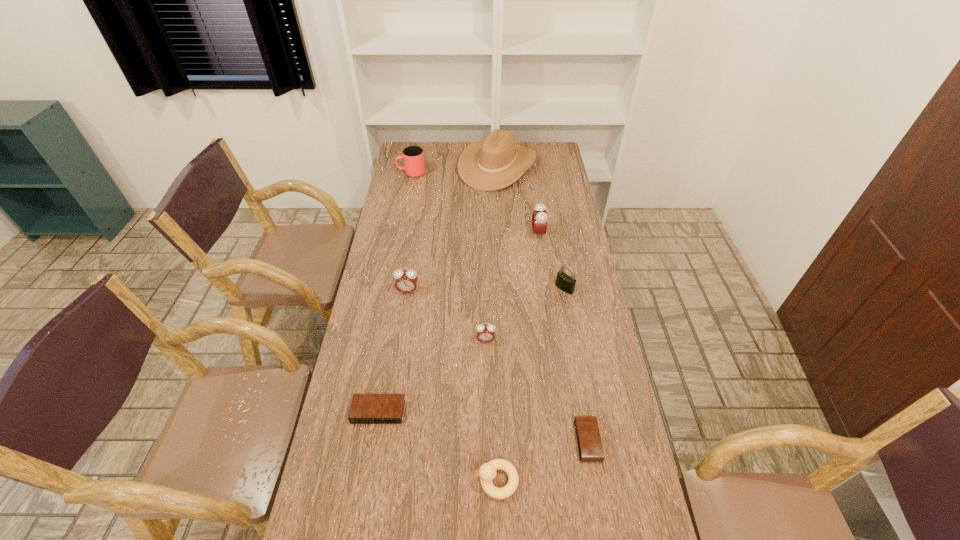
Where is `the left black alarm clock`? The height and width of the screenshot is (540, 960). the left black alarm clock is located at coordinates (365, 408).

The width and height of the screenshot is (960, 540). What are the coordinates of `the bigger black alarm clock` in the screenshot? It's located at (365, 408).

This screenshot has height=540, width=960. Identify the location of the shortest alarm clock. (590, 448).

Identify the location of the smaller black alarm clock. (590, 448).

Locate an element on the screen. The width and height of the screenshot is (960, 540). vacant space located on the right of the brown cowboy hat is located at coordinates (558, 166).

I want to click on free region located on the clock face of the rightmost pink alarm clock, so click(437, 234).

Locate an element on the screen. free region located 0.090m on the clock face of the rightmost pink alarm clock is located at coordinates (511, 234).

Locate an element on the screen. The image size is (960, 540). vacant space situated 0.300m on the clock face of the rightmost pink alarm clock is located at coordinates (461, 234).

I want to click on free point located 0.260m on the clock face of the second farthest pink alarm clock, so click(397, 355).

Find the location of `blank area located on the back of the black padlock`. blank area located on the back of the black padlock is located at coordinates (562, 271).